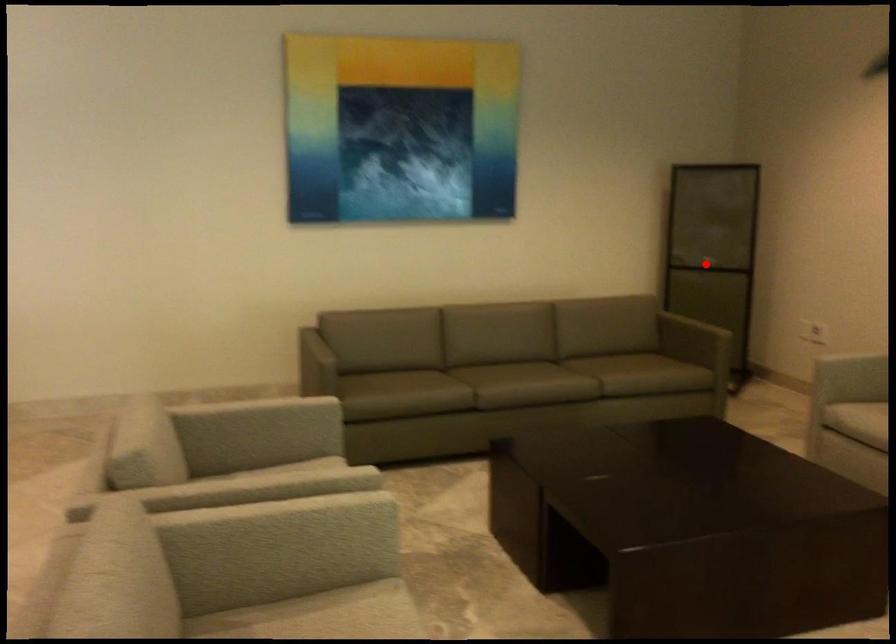
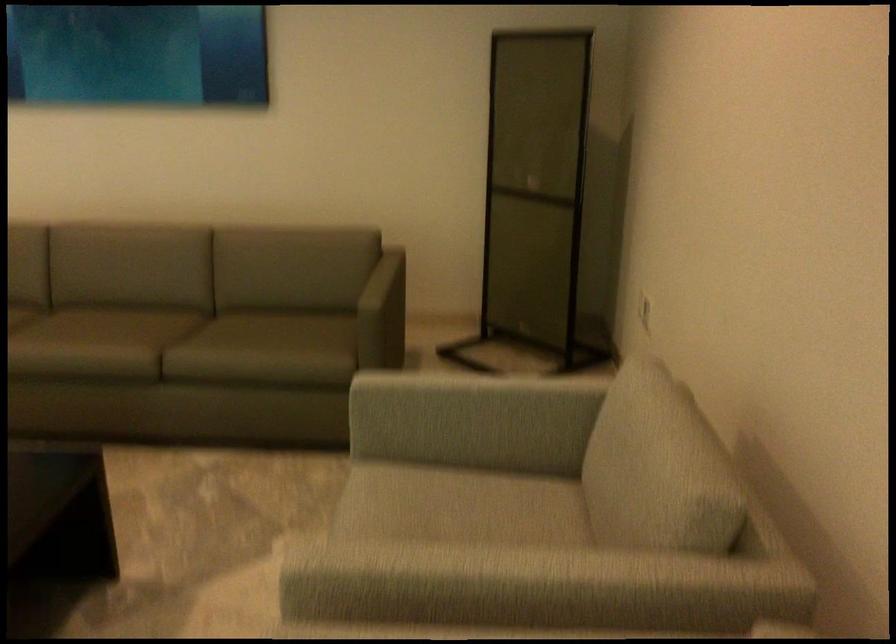
Find the pixel in the second image that matches the highlighted location in the first image.

(536, 194)